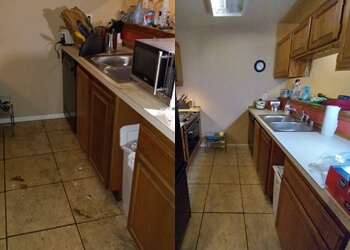
Locate an element on the screen. The height and width of the screenshot is (250, 350). dirty floor is located at coordinates (62, 211).